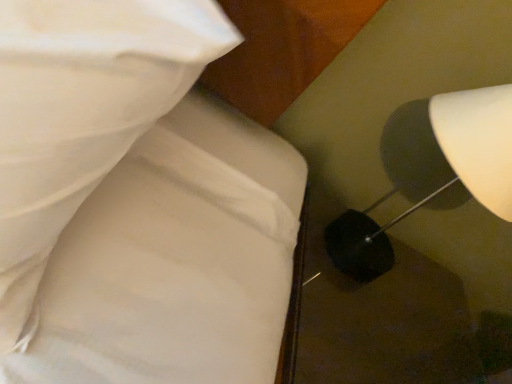
Question: Can you confirm if white fabric bed at upper left is shorter than white glossy lampshade at right?

Choices:
 (A) yes
 (B) no

Answer: (B)

Question: Can you see white fabric bed at upper left touching white glossy lampshade at right?

Choices:
 (A) no
 (B) yes

Answer: (A)

Question: Considering the relative sizes of white fabric bed at upper left and white glossy lampshade at right in the image provided, is white fabric bed at upper left wider than white glossy lampshade at right?

Choices:
 (A) no
 (B) yes

Answer: (B)

Question: Is white fabric bed at upper left at the left side of white glossy lampshade at right?

Choices:
 (A) yes
 (B) no

Answer: (A)

Question: Is white fabric bed at upper left further to the viewer compared to white glossy lampshade at right?

Choices:
 (A) no
 (B) yes

Answer: (A)

Question: Considering the relative sizes of white fabric bed at upper left and white glossy lampshade at right in the image provided, is white fabric bed at upper left smaller than white glossy lampshade at right?

Choices:
 (A) yes
 (B) no

Answer: (A)

Question: From the image's perspective, is white glossy lampshade at right located beneath white fabric bed at upper left?

Choices:
 (A) no
 (B) yes

Answer: (A)

Question: Is white glossy lampshade at right facing towards white fabric bed at upper left?

Choices:
 (A) yes
 (B) no

Answer: (B)

Question: Does white glossy lampshade at right have a larger size compared to white fabric bed at upper left?

Choices:
 (A) yes
 (B) no

Answer: (A)

Question: Does white glossy lampshade at right have a greater height compared to white fabric bed at upper left?

Choices:
 (A) no
 (B) yes

Answer: (A)

Question: Can you confirm if white glossy lampshade at right is positioned to the left of white fabric bed at upper left?

Choices:
 (A) no
 (B) yes

Answer: (A)

Question: From the image's perspective, would you say white glossy lampshade at right is positioned over white fabric bed at upper left?

Choices:
 (A) no
 (B) yes

Answer: (B)

Question: From a real-world perspective, is white glossy lampshade at right positioned above or below white fabric bed at upper left?

Choices:
 (A) above
 (B) below

Answer: (B)